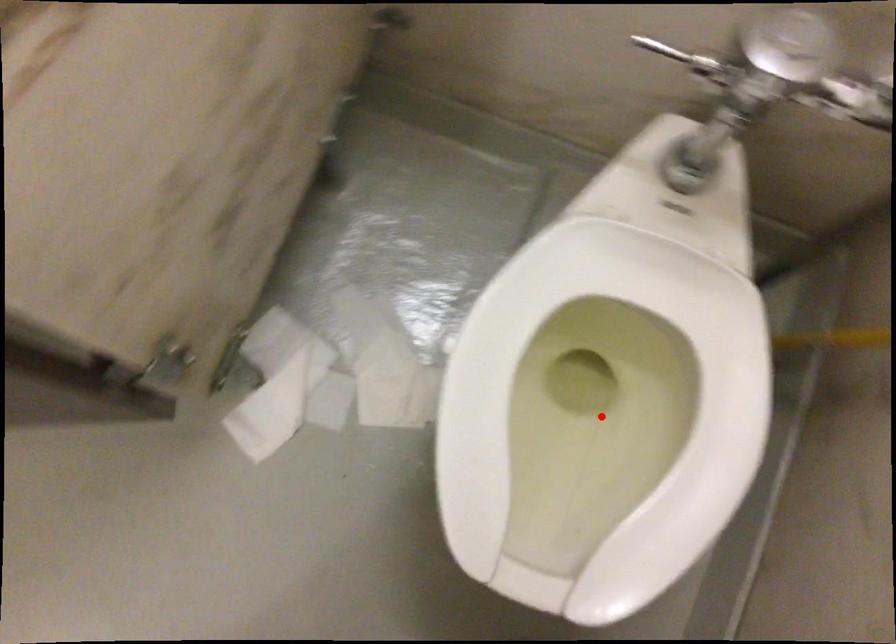
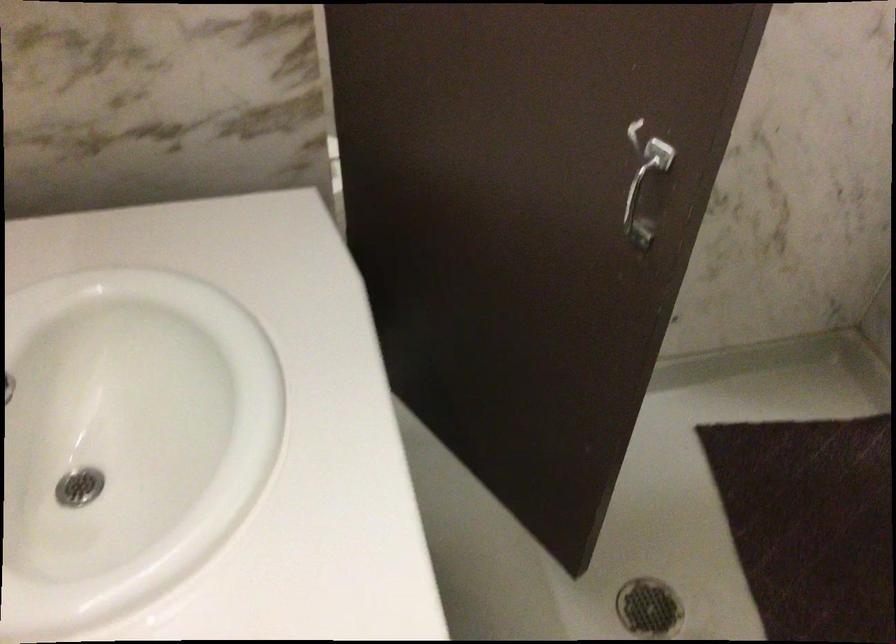
Question: I am providing you with two images of the same scene from different viewpoints. A red point is marked on the first image. Can you still see the location of the red point in image 2?

Choices:
 (A) Yes
 (B) No

Answer: (B)